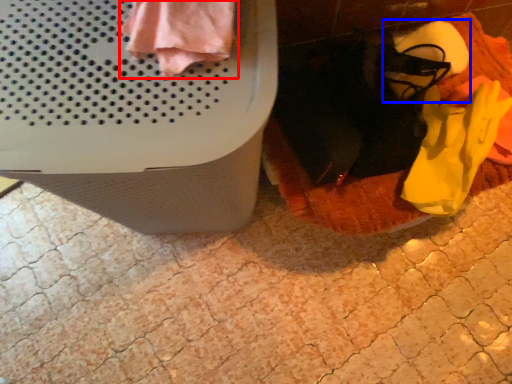
Question: Which object is further to the camera taking this photo, clothing (highlighted by a red box) or footwear (highlighted by a blue box)?

Choices:
 (A) clothing
 (B) footwear

Answer: (B)